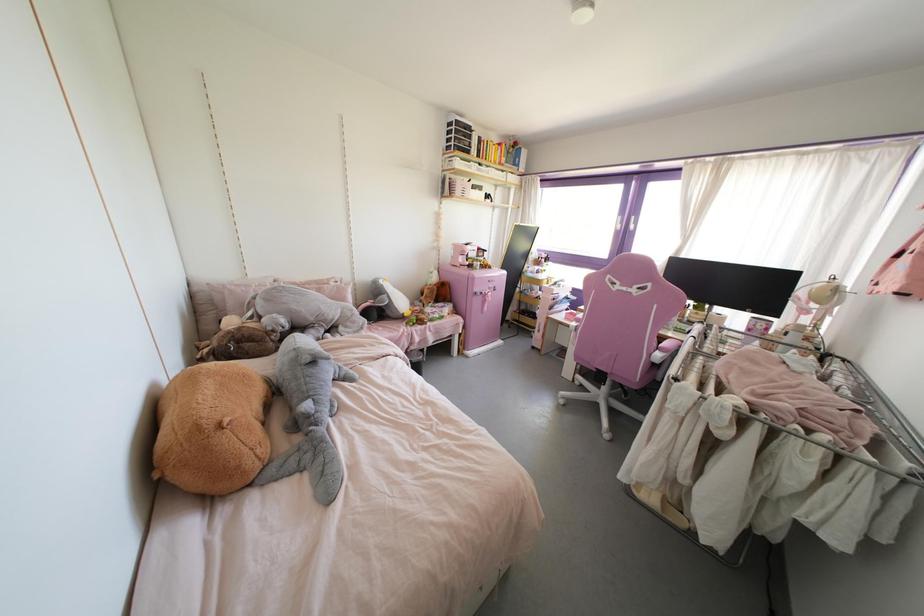
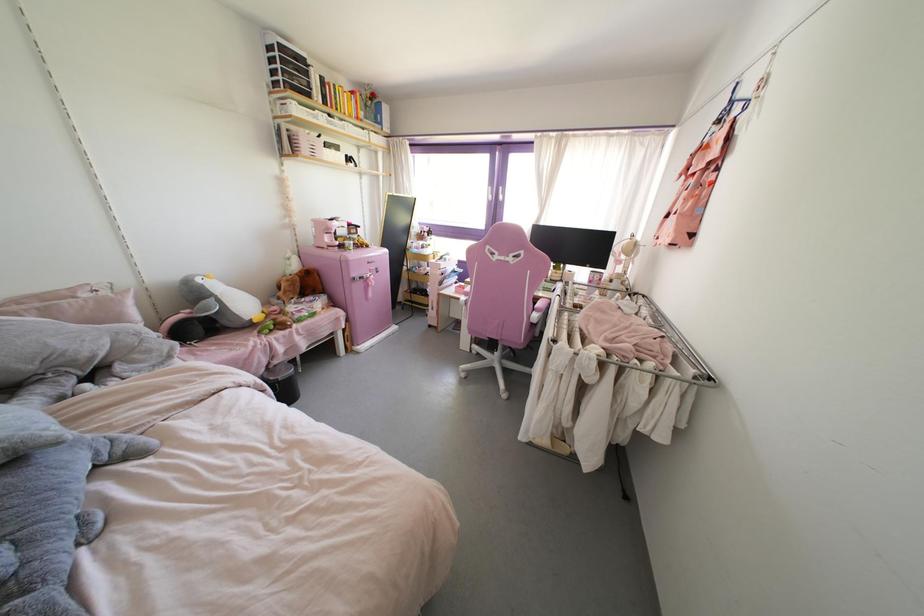
Locate, in the second image, the point that corresponds to the point at 405,314 in the first image.

(254, 320)